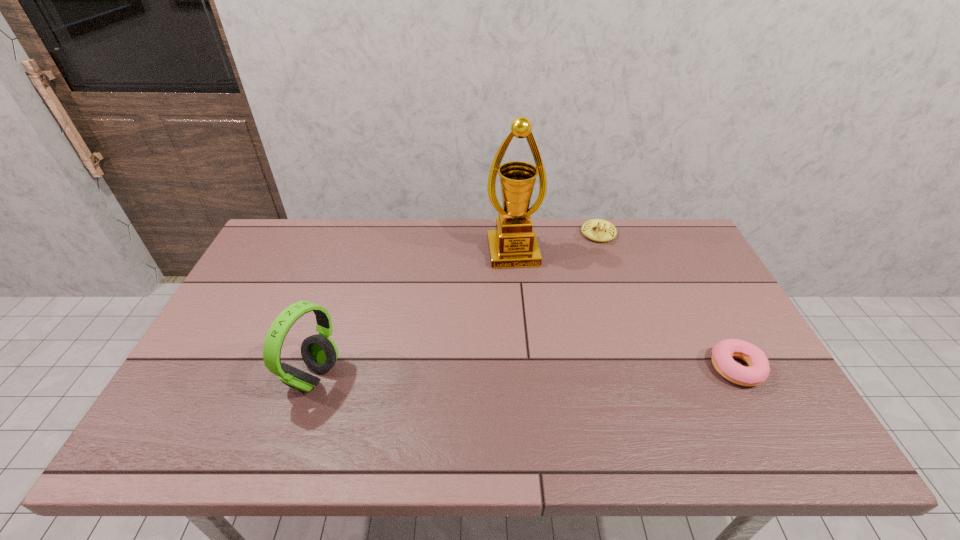
You are a GUI agent. You are given a task and a screenshot of the screen. Output one action in this format:
    pyautogui.click(x=<x>, y=<y>)
    Task: Click on the object present at the right edge
    
    Given the screenshot: What is the action you would take?
    pyautogui.click(x=758, y=371)

The width and height of the screenshot is (960, 540). What are the coordinates of `object at the near right corner` in the screenshot? It's located at (758, 371).

This screenshot has width=960, height=540. I want to click on blank space at the far edge of the desktop, so click(592, 253).

Identify the location of vacant space at the near edge of the desktop. (453, 413).

Locate an element on the screen. The height and width of the screenshot is (540, 960). free space at the left edge of the desktop is located at coordinates (220, 357).

In the image, there is a desktop. At what (x,y) coordinates should I click in order to perform the action: click on free region at the right edge. Please return your answer as a coordinate pair (x, y). Looking at the image, I should click on (677, 267).

Where is `free region at the far left corner of the desktop`? free region at the far left corner of the desktop is located at coordinates (277, 246).

This screenshot has width=960, height=540. Find the location of `vacant space at the near left corner of the desktop`. vacant space at the near left corner of the desktop is located at coordinates (205, 409).

The image size is (960, 540). In order to click on free region at the far right corner of the desktop in this screenshot , I will do `click(686, 245)`.

Locate an element on the screen. free space between the shortest object and the headset is located at coordinates (525, 372).